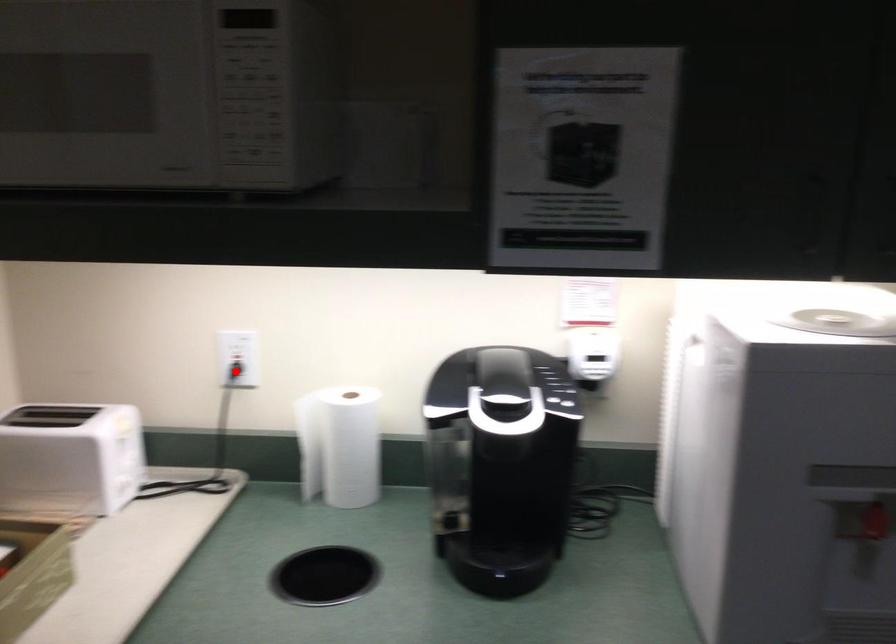
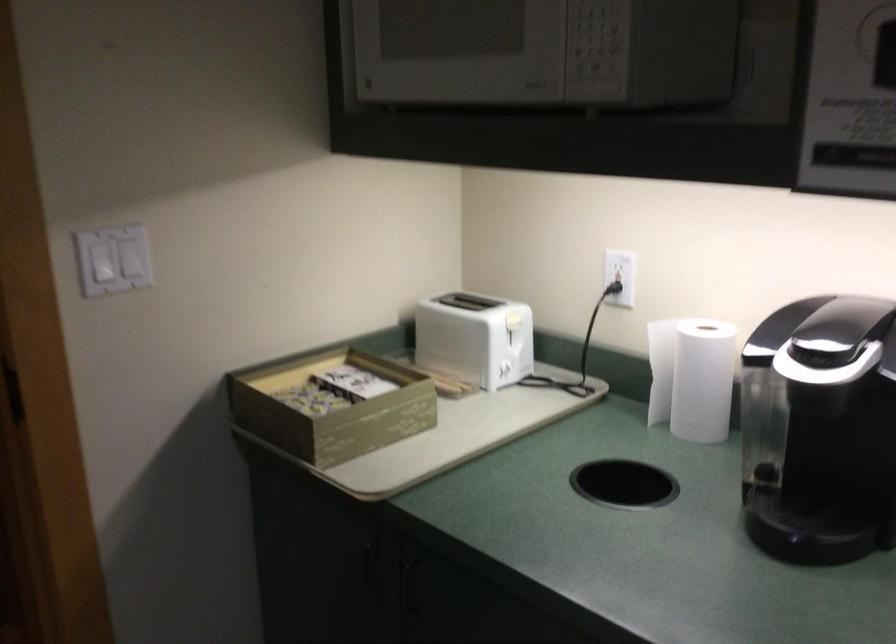
Where in the second image is the point corresponding to the highlighted location from the first image?

(613, 288)